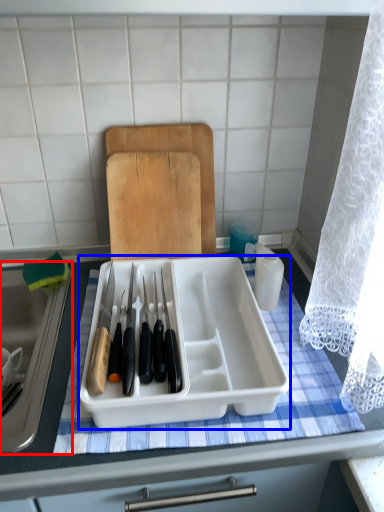
Question: Which point is closer to the camera, sink (highlighted by a red box) or kitchen appliance (highlighted by a blue box)?

Choices:
 (A) sink
 (B) kitchen appliance

Answer: (A)